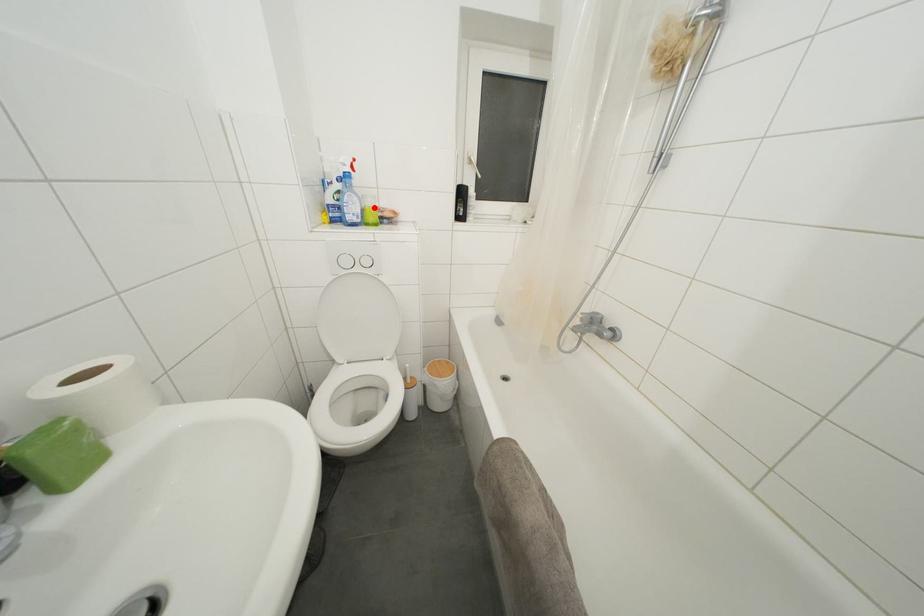
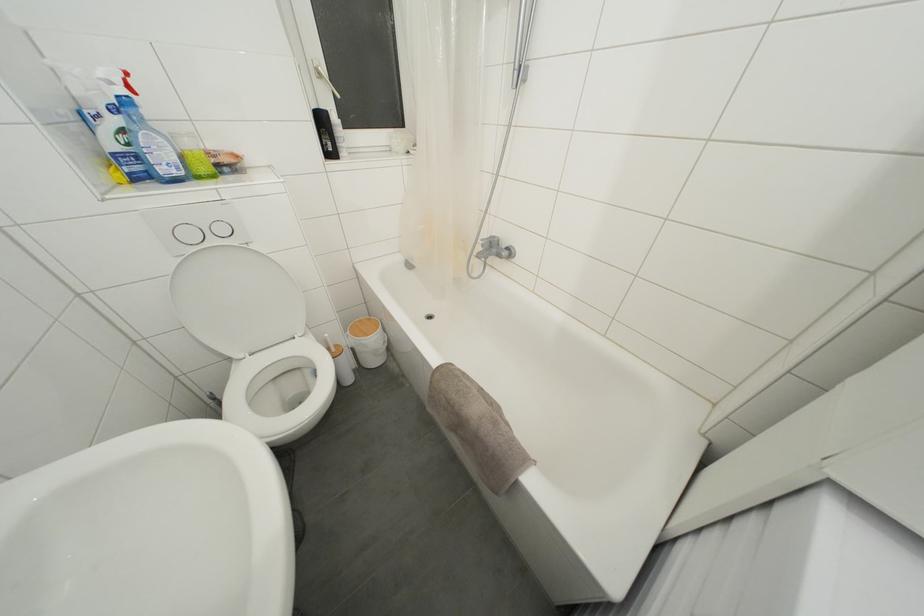
Where in the second image is the point corresponding to the highlighted location from the first image?

(193, 148)